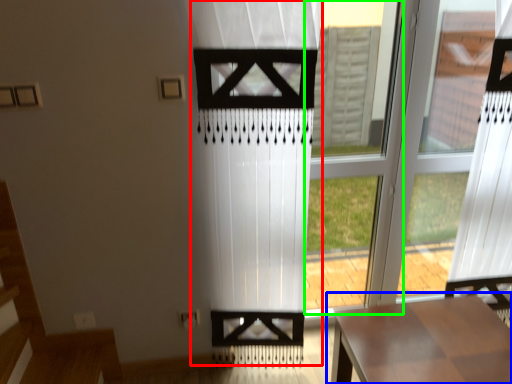
Question: Which object is positioned farthest from curtain (highlighted by a red box)? Select from table (highlighted by a blue box) and window frame (highlighted by a green box).

Choices:
 (A) table
 (B) window frame

Answer: (B)